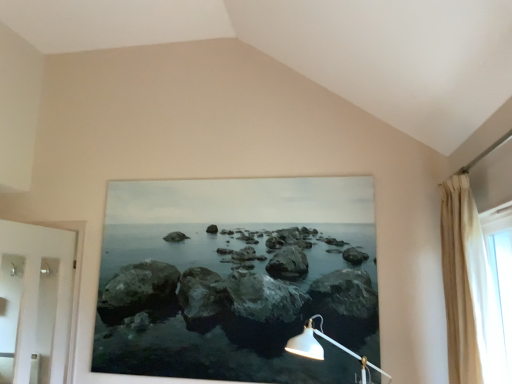
What do you see at coordinates (464, 283) in the screenshot?
I see `beige fabric curtain at right` at bounding box center [464, 283].

In order to click on translucent fabric curtain at right in this screenshot , I will do `click(501, 275)`.

In terms of height, does beige fabric curtain at right look taller or shorter compared to translucent fabric curtain at right?

Clearly, beige fabric curtain at right is taller compared to translucent fabric curtain at right.

Is beige fabric curtain at right far from translucent fabric curtain at right?

No, beige fabric curtain at right is not far from translucent fabric curtain at right.

Image resolution: width=512 pixels, height=384 pixels. What are the coordinates of `curtain above the translucent fabric curtain at right (from the image's perspective)` in the screenshot? It's located at (464, 283).

Considering the sizes of objects beige fabric curtain at right and translucent fabric curtain at right in the image provided, who is wider, beige fabric curtain at right or translucent fabric curtain at right?

beige fabric curtain at right.

Is point (20, 239) positioned before point (485, 302)?

No, it is not.

Would you say white glossy door at left is inside or outside beige fabric curtain at right?

white glossy door at left cannot be found inside beige fabric curtain at right.

Is white glossy door at left looking in the opposite direction of beige fabric curtain at right?

No, beige fabric curtain at right is not at the back of white glossy door at left.

Is white glossy door at left to the left of beige fabric curtain at right from the viewer's perspective?

Indeed, white glossy door at left is positioned on the left side of beige fabric curtain at right.

Is white glossy door at left smaller than translucent fabric curtain at right?

No.

Considering the points (32, 262) and (502, 327), which point is in front, point (32, 262) or point (502, 327)?

The point (502, 327) is closer to the camera.

Is white glossy door at left taller than translucent fabric curtain at right?

Yes.

Is white glossy door at left with translucent fabric curtain at right?

white glossy door at left and translucent fabric curtain at right are clearly separated.

From a real-world perspective, between beige fabric curtain at right and white glossy door at left, who is vertically higher?

In real-world perspective, beige fabric curtain at right is above.

Considering the sizes of beige fabric curtain at right and white glossy door at left in the image, is beige fabric curtain at right taller or shorter than white glossy door at left?

beige fabric curtain at right is shorter than white glossy door at left.

Locate an element on the screen. curtain located above the white glossy door at left (from a real-world perspective) is located at coordinates (464, 283).

Is point (454, 354) farther from camera compared to point (6, 298)?

That is False.

Considering their positions, is translucent fabric curtain at right located in front of or behind beige fabric curtain at right?

In the image, translucent fabric curtain at right appears in front of beige fabric curtain at right.

From the image's perspective, is translucent fabric curtain at right under beige fabric curtain at right?

Correct, translucent fabric curtain at right appears lower than beige fabric curtain at right in the image.

I want to click on window beneath the beige fabric curtain at right (from a real-world perspective), so click(501, 275).

From a real-world perspective, is translucent fabric curtain at right located beneath beige fabric curtain at right?

Yes, from a real-world perspective, translucent fabric curtain at right is under beige fabric curtain at right.

Which is more to the right, translucent fabric curtain at right or white glossy door at left?

From the viewer's perspective, translucent fabric curtain at right appears more on the right side.

From the picture: Would you say translucent fabric curtain at right is inside or outside white glossy door at left?

translucent fabric curtain at right is outside white glossy door at left.

Is translucent fabric curtain at right bigger or smaller than white glossy door at left?

In the image, translucent fabric curtain at right appears to be smaller than white glossy door at left.

Is translucent fabric curtain at right oriented away from white glossy door at left?

No.

I want to click on window lying in front of the beige fabric curtain at right, so click(501, 275).

Locate an element on the screen. The height and width of the screenshot is (384, 512). curtain to the right of white glossy door at left is located at coordinates (464, 283).

Looking at the image, which one is located further to white glossy door at left, translucent fabric curtain at right or beige fabric curtain at right?

The object further to white glossy door at left is translucent fabric curtain at right.

Looking at the image, which one is located closer to translucent fabric curtain at right, white glossy door at left or beige fabric curtain at right?

beige fabric curtain at right is positioned closer to the anchor translucent fabric curtain at right.

Looking at the image, which one is located further to beige fabric curtain at right, translucent fabric curtain at right or white glossy door at left?

Among the two, white glossy door at left is located further to beige fabric curtain at right.

When comparing their distances from white glossy door at left, does beige fabric curtain at right or translucent fabric curtain at right seem further?

The object further to white glossy door at left is translucent fabric curtain at right.

From the image, which object appears to be nearer to translucent fabric curtain at right, beige fabric curtain at right or white glossy door at left?

beige fabric curtain at right.

When comparing their distances from beige fabric curtain at right, does white glossy door at left or translucent fabric curtain at right seem further?

white glossy door at left is further to beige fabric curtain at right.

At what (x,y) coordinates should I click in order to perform the action: click on curtain located between white glossy door at left and translucent fabric curtain at right in the left-right direction. Please return your answer as a coordinate pair (x, y). The width and height of the screenshot is (512, 384). Looking at the image, I should click on (464, 283).